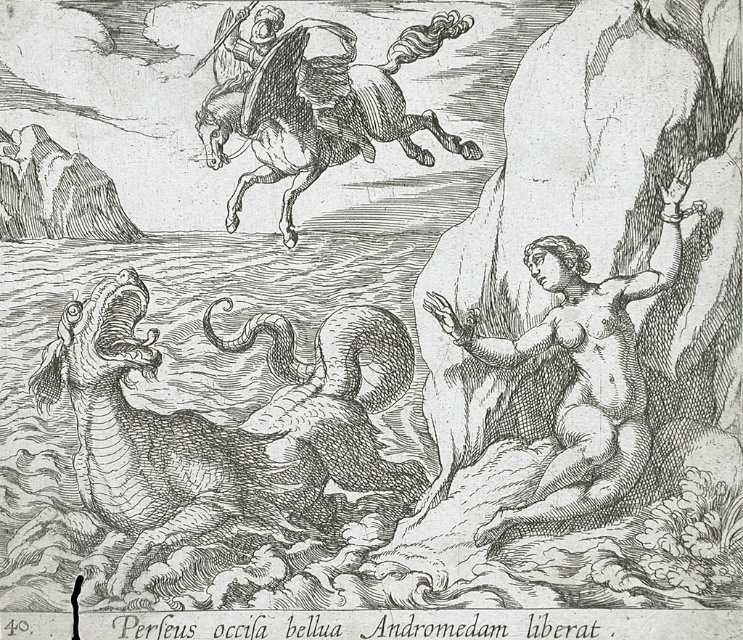
Question: Which of these objects is positioned farthest from the gray textured sea monster at lower left?

Choices:
 (A) smooth skin nude figure at right
 (B) smooth white horse at upper center

Answer: (B)

Question: Which point is closer to the camera?

Choices:
 (A) gray textured sea monster at lower left
 (B) smooth white horse at upper center
 (C) smooth skin nude figure at right

Answer: (B)

Question: Can you confirm if gray textured sea monster at lower left is smaller than smooth skin nude figure at right?

Choices:
 (A) no
 (B) yes

Answer: (A)

Question: From the image, what is the correct spatial relationship of gray textured sea monster at lower left in relation to smooth white horse at upper center?

Choices:
 (A) below
 (B) above

Answer: (A)

Question: Is smooth skin nude figure at right wider than smooth white horse at upper center?

Choices:
 (A) yes
 (B) no

Answer: (B)

Question: Among these objects, which one is nearest to the camera?

Choices:
 (A) gray textured sea monster at lower left
 (B) smooth white horse at upper center

Answer: (B)